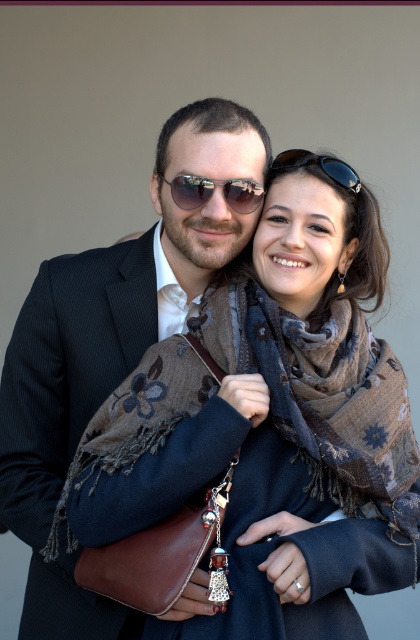
You are a photographer setting up for a portrait shoot. You want to ensure that the brown textured scarf at center and the black reflective sunglasses at upper center are both in focus. The camera you are using has a depth of field that can cover objects within a 25 inch range. Can both items be in focus at the same time?

The distance between the brown textured scarf at center and the black reflective sunglasses at upper center is 22.93 inches, which is within the 25 inch range of the camera. Therefore, both items can be in focus simultaneously.

You are standing at the point marked by coordinates point (270, 321) and want to take a photo of the two people in the scene. If your camera is 1.76 meters away from the point, will you be able to capture both individuals in the frame?

Yes, since the camera is exactly 1.76 meters away from the point (270, 321), and both individuals are positioned at that point, they will both be in the frame.

You are a photographer trying to capture a closeup shot of the brown textured scarf at center and the black reflective sunglasses at upper center. Which object should you focus on first if you want to ensure both are in focus without moving the camera?

The brown textured scarf at center is to the right of the black reflective sunglasses at upper center, so you should focus on the black reflective sunglasses at upper center first since it is closer to the camera. This way, the depth of field will cover both objects when focusing on the closer one.